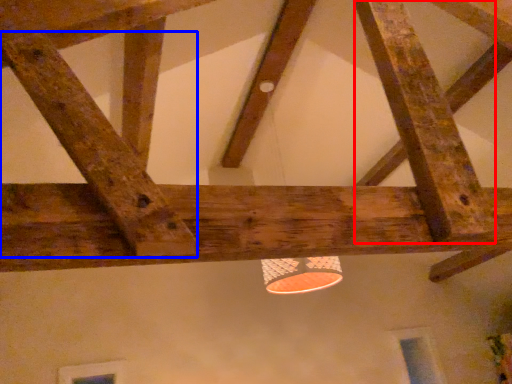
Question: Which point is closer to the camera, plank (highlighted by a red box) or plank (highlighted by a blue box)?

Choices:
 (A) plank
 (B) plank

Answer: (B)